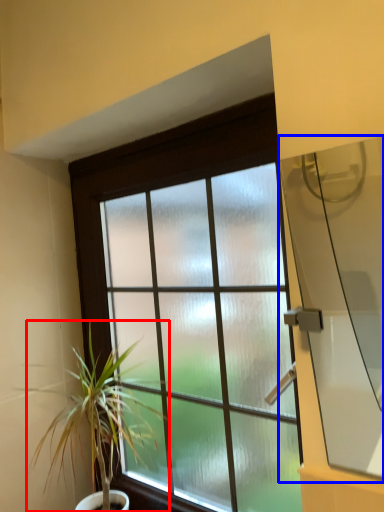
Question: Which object appears farthest to the camera in this image, houseplant (highlighted by a red box) or window screen (highlighted by a blue box)?

Choices:
 (A) houseplant
 (B) window screen

Answer: (A)